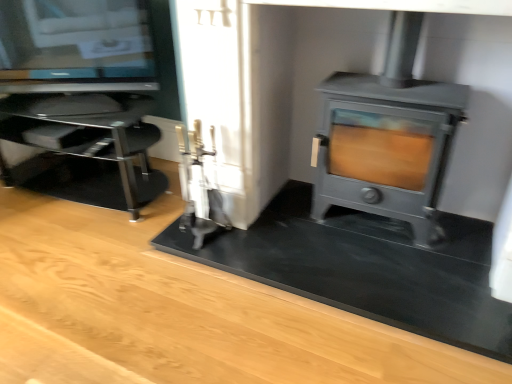
Question: Considering the positions of matte gray wood burning stove at right and transparent glass tv stand at left in the image, is matte gray wood burning stove at right taller or shorter than transparent glass tv stand at left?

Choices:
 (A) tall
 (B) short

Answer: (A)

Question: From the image's perspective, is matte gray wood burning stove at right located above or below transparent glass tv stand at left?

Choices:
 (A) above
 (B) below

Answer: (A)

Question: Considering the positions of point (423, 238) and point (5, 180), is point (423, 238) closer or farther from the camera than point (5, 180)?

Choices:
 (A) farther
 (B) closer

Answer: (B)

Question: Is point (59, 107) closer or farther from the camera than point (330, 185)?

Choices:
 (A) farther
 (B) closer

Answer: (A)

Question: Considering their positions, is transparent glass tv stand at left located in front of or behind matte gray wood burning stove at right?

Choices:
 (A) behind
 (B) front

Answer: (A)

Question: From a real-world perspective, is transparent glass tv stand at left physically located above or below matte gray wood burning stove at right?

Choices:
 (A) below
 (B) above

Answer: (A)

Question: From their relative heights in the image, would you say transparent glass tv stand at left is taller or shorter than matte gray wood burning stove at right?

Choices:
 (A) tall
 (B) short

Answer: (B)